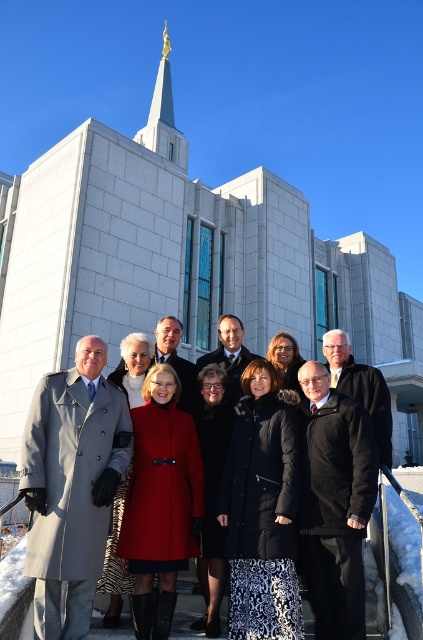
Does point (2, 230) come closer to viewer compared to point (233, 333)?

No, it is not.

Which is in front, point (8, 260) or point (109, 570)?

Point (109, 570) is more forward.

Between point (18, 384) and point (189, 404), which one is positioned in front?

Point (189, 404) is in front.

You are a GUI agent. You are given a task and a screenshot of the screen. Output one action in this format:
    pyautogui.click(x=<x>, y=<y>)
    Task: Click on the white stone church at center
    This screenshot has width=423, height=640.
    Given the screenshot: What is the action you would take?
    pyautogui.click(x=184, y=269)

Locate an element on the screen. The width and height of the screenshot is (423, 640). white stone church at center is located at coordinates (184, 269).

Does white stone church at center appear over gold metallic spire at upper center?

Incorrect, white stone church at center is not positioned above gold metallic spire at upper center.

Is point (216, 200) positioned after point (170, 49)?

No, it is in front of (170, 49).

Find the location of a particular element. white stone church at center is located at coordinates (184, 269).

Does red wool coat at center appear on the left side of gold metallic spire at upper center?

Incorrect, red wool coat at center is not on the left side of gold metallic spire at upper center.

Describe the element at coordinates (136, 353) in the screenshot. I see `red wool coat at center` at that location.

You are a GUI agent. You are given a task and a screenshot of the screen. Output one action in this format:
    pyautogui.click(x=<x>, y=<y>)
    Task: Click on the red wool coat at center
    This screenshot has height=640, width=423.
    Given the screenshot: What is the action you would take?
    pyautogui.click(x=136, y=353)